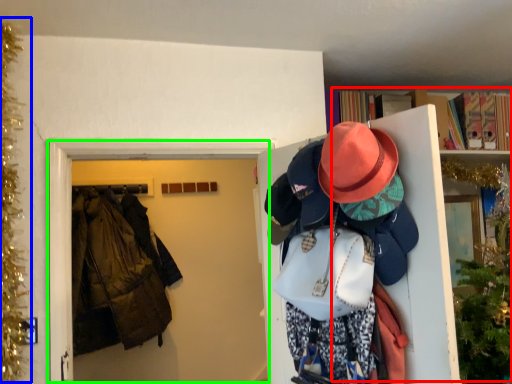
Question: Which is nearer to the bookcase (highlighted by a red box)? christmas decoration (highlighted by a blue box) or door (highlighted by a green box).

Choices:
 (A) christmas decoration
 (B) door

Answer: (B)